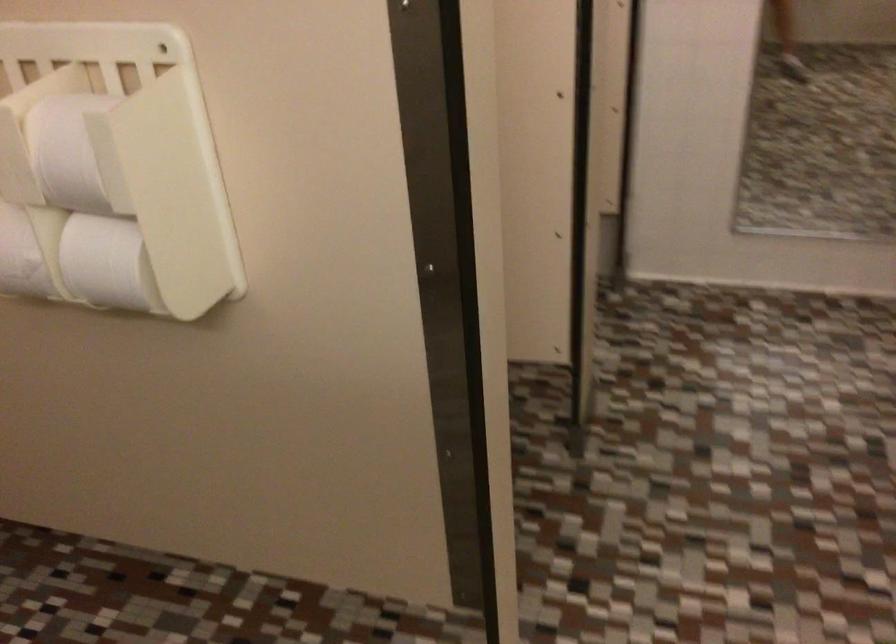
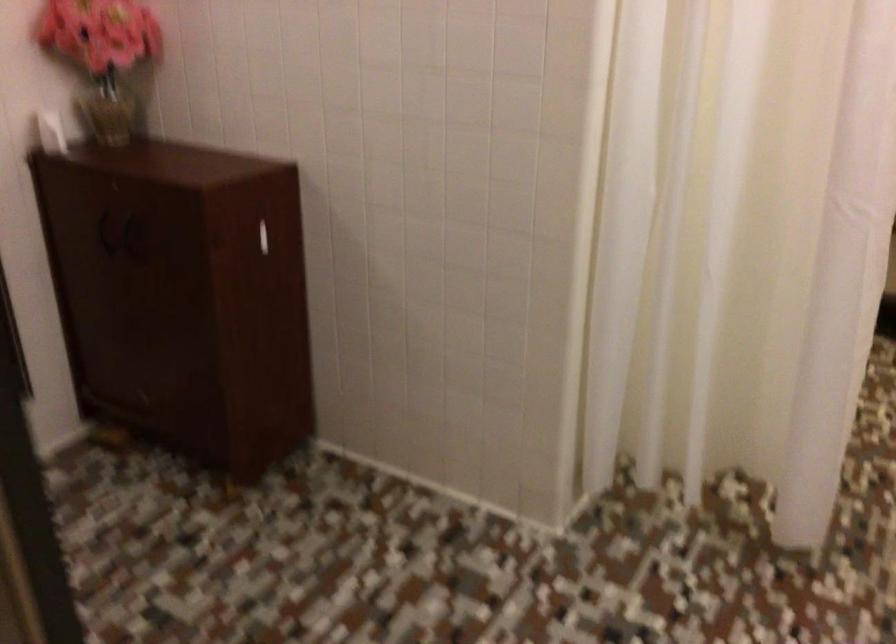
Question: How did the camera likely rotate?

Choices:
 (A) Left
 (B) Right
 (C) Up
 (D) Down

Answer: (B)